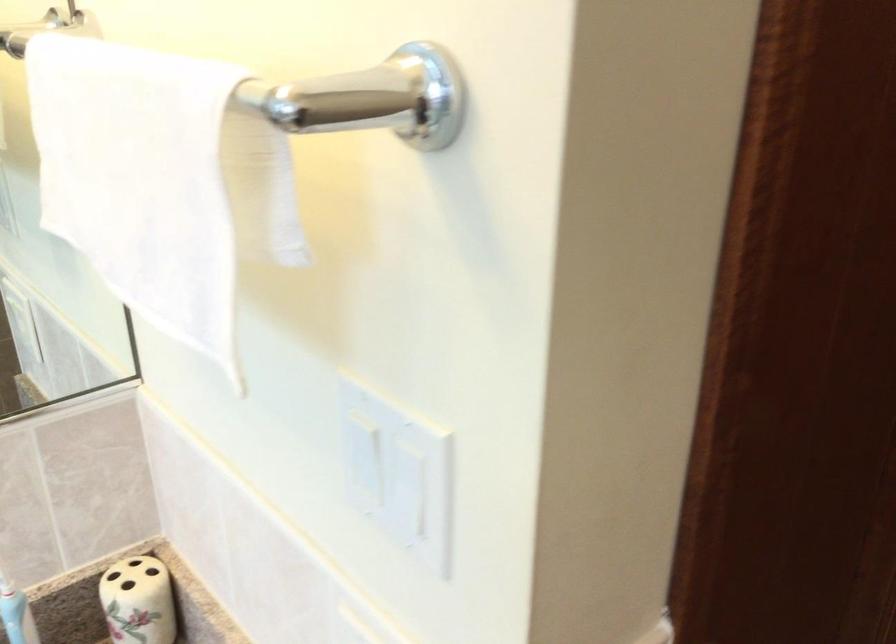
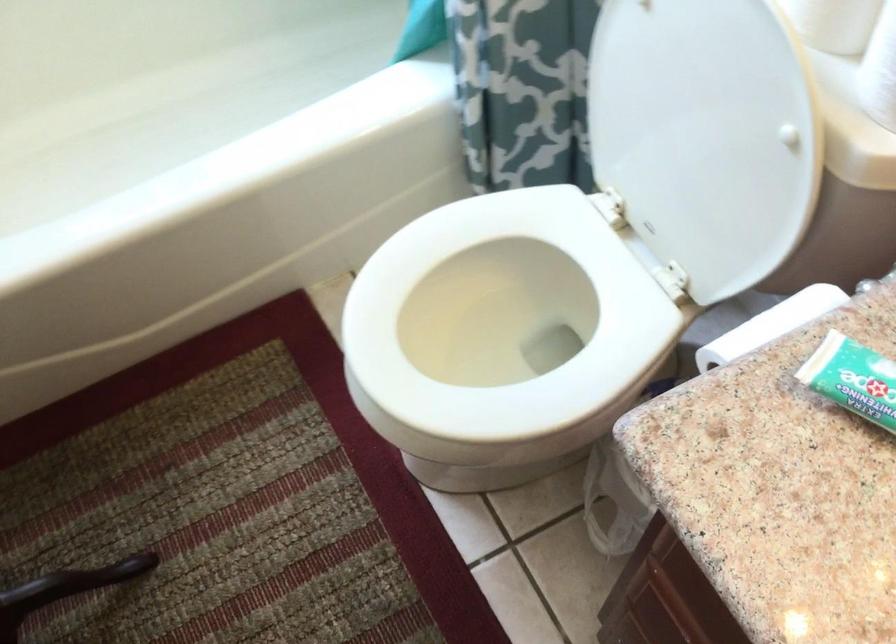
First-person continuous shooting, in which direction is the camera rotating?

The rotation direction of the camera is left-down.